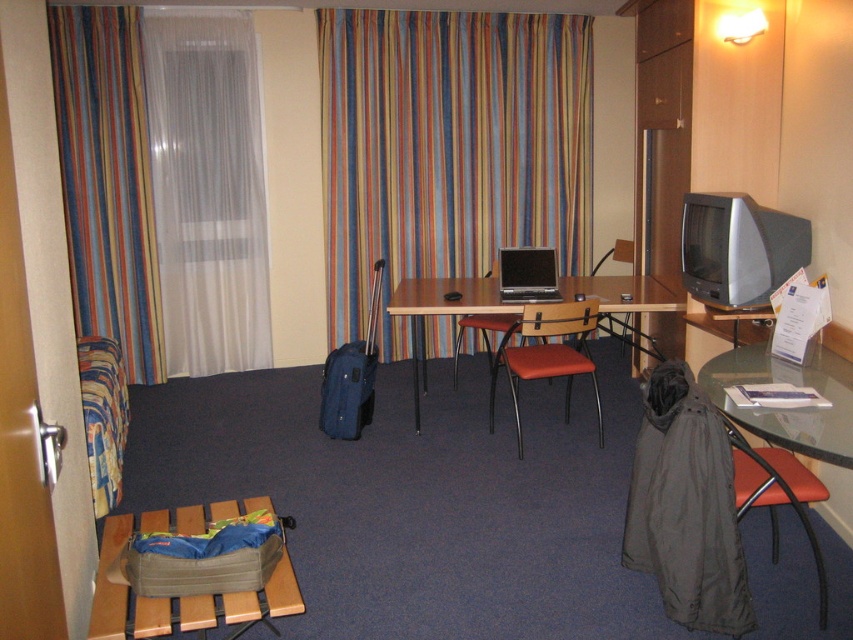
Does striped fabric curtain at left have a larger size compared to matte gray stool at lower left?

Yes, striped fabric curtain at left is bigger than matte gray stool at lower left.

This screenshot has height=640, width=853. I want to click on striped fabric curtain at left, so click(107, 179).

Does striped fabric curtain at left have a greater width compared to matte black laptop at center?

Yes, striped fabric curtain at left is wider than matte black laptop at center.

Does point (114, 179) lie in front of point (498, 252)?

That is False.

Find the location of a particular element. striped fabric curtain at left is located at coordinates (107, 179).

Can you confirm if striped fabric curtain at left is positioned above transparent glass table at lower right?

Yes, striped fabric curtain at left is above transparent glass table at lower right.

Image resolution: width=853 pixels, height=640 pixels. I want to click on striped fabric curtain at left, so click(107, 179).